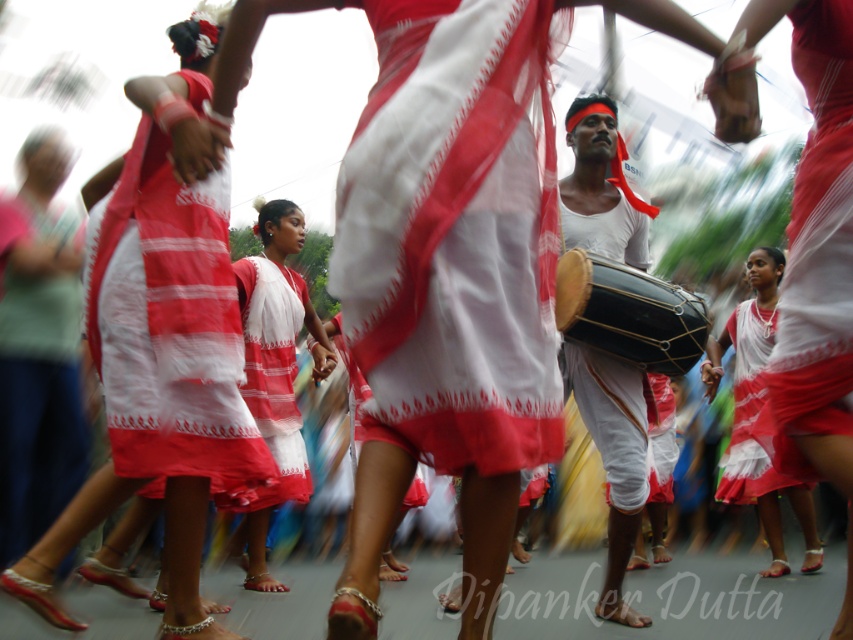
How distant is matte white dress at center from red and white striped fabric dress at center?

A distance of 3.05 inches exists between matte white dress at center and red and white striped fabric dress at center.

In the scene shown: Which is more to the right, matte white dress at center or red and white striped fabric dress at center?

matte white dress at center

Which is behind, point (151, 376) or point (157, 435)?

The point (151, 376) is more distant.

You are a GUI agent. You are given a task and a screenshot of the screen. Output one action in this format:
    pyautogui.click(x=<x>, y=<y>)
    Task: Click on the matte white dress at center
    This screenshot has width=853, height=640.
    Given the screenshot: What is the action you would take?
    pyautogui.click(x=163, y=340)

Is red and white striped fabric dress at center behind white matte drum at center?

No, it is not.

Who is shorter, red and white striped fabric dress at center or white matte drum at center?

Standing shorter between the two is white matte drum at center.

Does point (225, 444) lie behind point (618, 189)?

No, (225, 444) is in front of (618, 189).

Identify the location of red and white striped fabric dress at center. (175, 326).

Which is in front, point (602, 397) or point (758, 321)?

Point (602, 397)

Who is taller, white matte drum at center or white cotton saree at lower right?

white cotton saree at lower right

Is point (607, 477) more distant than point (718, 340)?

That is False.

Locate an element on the screen. white matte drum at center is located at coordinates (614, 458).